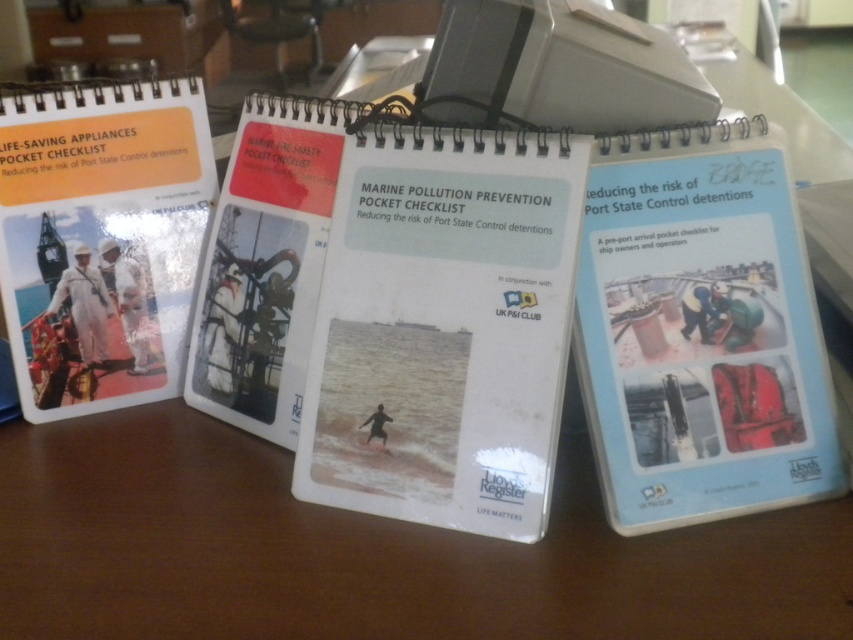
You are a photographer who needs to place your camera on the table so that it is exactly 1 meter away from the white paper notebook at center. Can you do that?

The white paper notebook at center and camera are 1.01 meters apart from each other, so you can adjust the camera to be exactly 1 meter away by moving it slightly closer.

You are organizing a desk and have two items to place side by side. You have a white plastic notebook at right and a matte white book at left. Which item should you place on the left side to ensure they fit properly?

The matte white book at left should be placed on the left side since it is narrower than the white plastic notebook at right, allowing them to fit better when placed side by side.